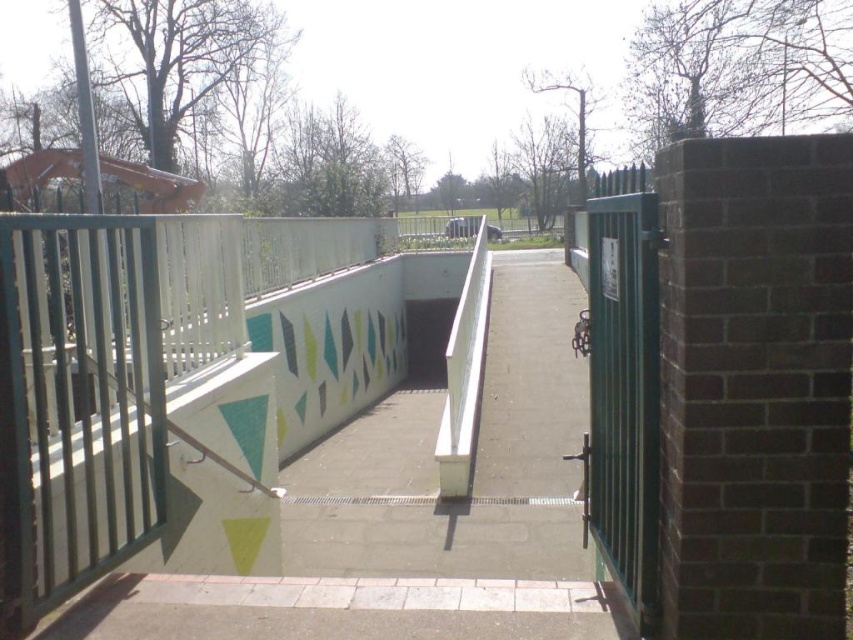
Can you confirm if white concrete path at center is positioned to the right of green metallic gate at right?

In fact, white concrete path at center is to the left of green metallic gate at right.

Is point (155, 620) more distant than point (654, 406)?

Yes, it is.

Which is in front, point (543, 609) or point (653, 371)?

Point (653, 371)

You are a GUI agent. You are given a task and a screenshot of the screen. Output one action in this format:
    pyautogui.click(x=<x>, y=<y>)
    Task: Click on the white concrete path at center
    This screenshot has width=853, height=640.
    Given the screenshot: What is the action you would take?
    pyautogui.click(x=416, y=509)